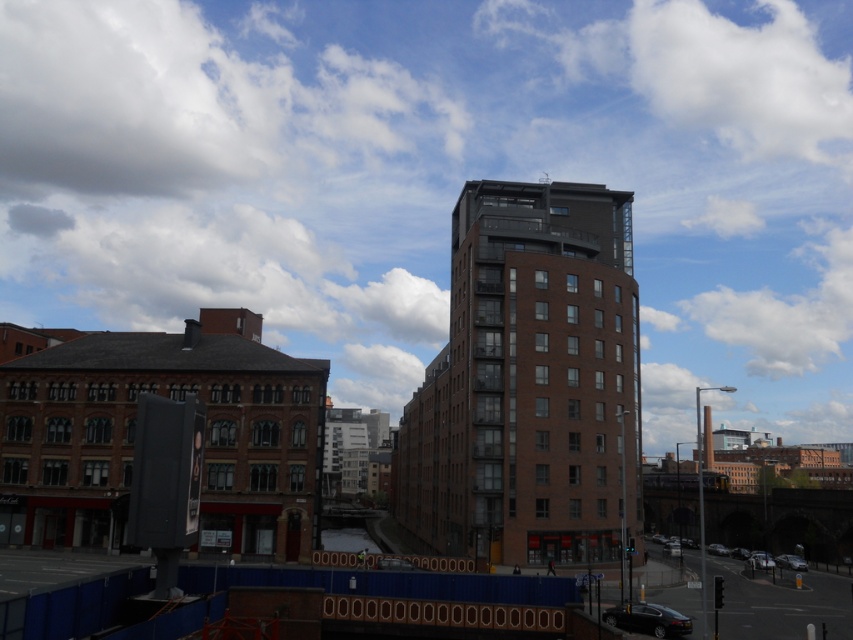
Is point (112, 218) closer to camera compared to point (590, 298)?

No, (112, 218) is further to viewer.

Does white fluffy cloud at upper center have a larger size compared to brown brick building at center?

Correct, white fluffy cloud at upper center is larger in size than brown brick building at center.

Describe the element at coordinates (438, 177) in the screenshot. I see `white fluffy cloud at upper center` at that location.

Locate an element on the screen. The image size is (853, 640). white fluffy cloud at upper center is located at coordinates (438, 177).